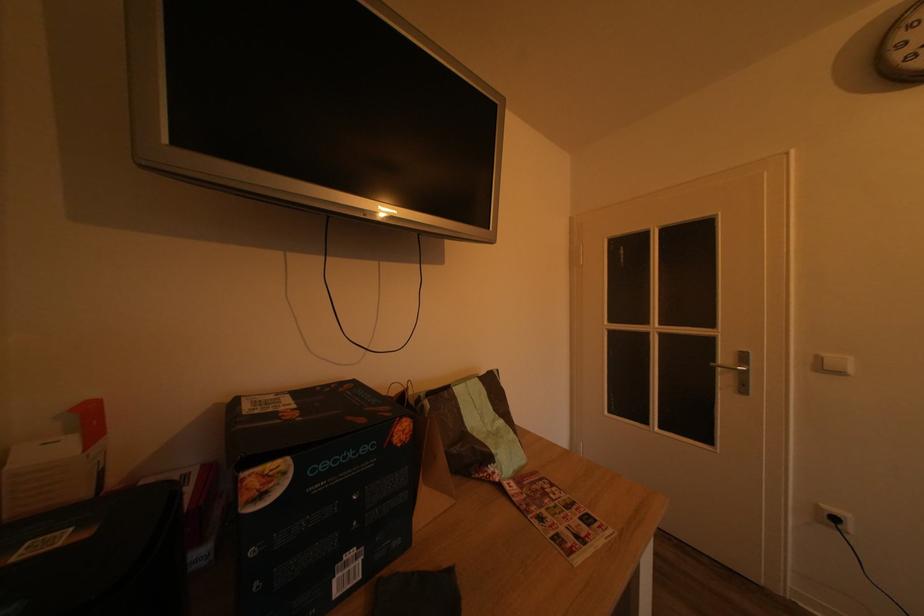
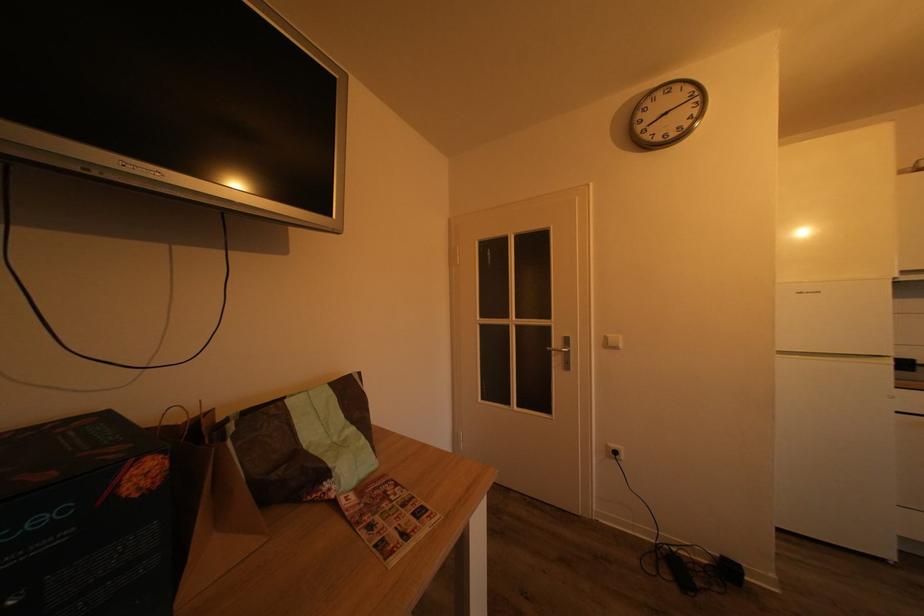
Question: The camera is either moving clockwise (left) or counter-clockwise (right) around the object. The first image is from the beginning of the video and the second image is from the end. Is the camera moving left or right when shooting the video?

Choices:
 (A) Left
 (B) Right

Answer: (A)